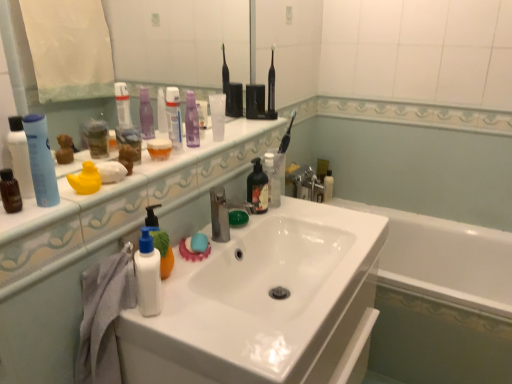
What is the approximate height of white glossy sink at center?

The height of white glossy sink at center is 5.77 inches.

What do you see at coordinates (218, 115) in the screenshot?
I see `transparent plastic mouthwash at center, the 3th mouthwash in the right-to-left sequence` at bounding box center [218, 115].

Measure the distance between transparent plastic mouthwash at center, the fourth mouthwash from the left, and camera.

The distance of transparent plastic mouthwash at center, the fourth mouthwash from the left, from camera is 1.34 meters.

The height and width of the screenshot is (384, 512). Describe the element at coordinates (159, 149) in the screenshot. I see `translucent plastic cup at center, arranged as the 5th mouthwash when viewed from the back` at that location.

At what (x,y) coordinates should I click in order to perform the action: click on translucent plastic bottle at center, the fifth toiletry when ordered from front to back. Please return your answer as a coordinate pair (x, y). This screenshot has height=384, width=512. Looking at the image, I should click on (273, 179).

What do you see at coordinates (273, 179) in the screenshot?
I see `translucent plastic bottle at center, which ranks as the fifth toiletry in left-to-right order` at bounding box center [273, 179].

Locate an element on the screen. white glossy sink at center is located at coordinates (265, 304).

Is blue matte shampoo bottle at left, which is counted as the 5th toiletry, starting from the back, positioned far away from white glossy sink at center?

No, there isn't a large distance between blue matte shampoo bottle at left, which is counted as the 5th toiletry, starting from the back, and white glossy sink at center.

Considering the positions of points (37, 144) and (258, 254), is point (37, 144) closer to camera compared to point (258, 254)?

Yes, it is in front of point (258, 254).

Is blue matte shampoo bottle at left, which is counted as the 5th toiletry, starting from the back, wider than white glossy sink at center?

In fact, blue matte shampoo bottle at left, which is counted as the 5th toiletry, starting from the back, might be narrower than white glossy sink at center.

Is blue matte shampoo bottle at left, arranged as the 1th toiletry when viewed from the front, inside or outside of white glossy sink at center?

blue matte shampoo bottle at left, arranged as the 1th toiletry when viewed from the front, cannot be found inside white glossy sink at center.

From the image's perspective, is translucent plastic bottle at center, arranged as the 1th toiletry when viewed from the right, located above brown matte bottle at left, the sixth mouthwash viewed from the right?

Indeed, from the image's perspective, translucent plastic bottle at center, arranged as the 1th toiletry when viewed from the right, is shown above brown matte bottle at left, the sixth mouthwash viewed from the right.

Which is correct: translucent plastic bottle at center, acting as the 1th toiletry starting from the back, is inside brown matte bottle at left, the first mouthwash viewed from the left, or outside of it?

translucent plastic bottle at center, acting as the 1th toiletry starting from the back, cannot be found inside brown matte bottle at left, the first mouthwash viewed from the left.

What's the angular difference between translucent plastic bottle at center, which ranks as the fifth toiletry in left-to-right order, and brown matte bottle at left, the sixth mouthwash viewed from the right,'s facing directions?

The facing directions of translucent plastic bottle at center, which ranks as the fifth toiletry in left-to-right order, and brown matte bottle at left, the sixth mouthwash viewed from the right, are 0.234 degrees apart.

From the image's perspective, is blue matte shampoo bottle at left, acting as the fifth toiletry starting from the right, located beneath translucent plastic bottle at center, which is the 5th mouthwash from left to right?

No, from the image's perspective, blue matte shampoo bottle at left, acting as the fifth toiletry starting from the right, is not below translucent plastic bottle at center, which is the 5th mouthwash from left to right.

Is translucent plastic bottle at center, arranged as the second mouthwash when viewed from the back, at the back of blue matte shampoo bottle at left, which is counted as the 5th toiletry, starting from the back?

No.

From the picture: How different are the orientations of blue matte shampoo bottle at left, arranged as the 1th toiletry when viewed from the front, and translucent plastic bottle at center, marked as the second mouthwash in a right-to-left arrangement, in degrees?

The angle between the facing direction of blue matte shampoo bottle at left, arranged as the 1th toiletry when viewed from the front, and the facing direction of translucent plastic bottle at center, marked as the second mouthwash in a right-to-left arrangement, is 0.234 degrees.

Based on their positions, is blue matte shampoo bottle at left, acting as the 1th toiletry starting from the left, located to the left or right of translucent plastic bottle at center, arranged as the second mouthwash when viewed from the back?

blue matte shampoo bottle at left, acting as the 1th toiletry starting from the left, is positioned on translucent plastic bottle at center, arranged as the second mouthwash when viewed from the back,'s left side.

Is translucent rubber soap at sink next to translucent plastic mouthwash at center, the fourth mouthwash from the right, and touching it?

No, translucent rubber soap at sink is not next to translucent plastic mouthwash at center, the fourth mouthwash from the right.

Does point (205, 244) lie in front of point (181, 150)?

Yes, point (205, 244) is in front of point (181, 150).

Considering the relative sizes of translucent rubber soap at sink and translucent plastic mouthwash at center, the fourth mouthwash from the right, in the image provided, is translucent rubber soap at sink smaller than translucent plastic mouthwash at center, the fourth mouthwash from the right,?

Indeed, translucent rubber soap at sink has a smaller size compared to translucent plastic mouthwash at center, the fourth mouthwash from the right.

Considering the relative positions of translucent rubber soap at sink and translucent plastic mouthwash at center, acting as the 4th mouthwash starting from the back, in the image provided, is translucent rubber soap at sink to the left or to the right of translucent plastic mouthwash at center, acting as the 4th mouthwash starting from the back,?

From the image, it's evident that translucent rubber soap at sink is to the right of translucent plastic mouthwash at center, acting as the 4th mouthwash starting from the back.

Is translucent plastic bottle at center, the fifth toiletry when ordered from front to back, looking in the opposite direction of white glossy counter top at upper center?

That's not correct — translucent plastic bottle at center, the fifth toiletry when ordered from front to back, is not looking away from white glossy counter top at upper center.

Does point (273, 176) lie behind point (245, 135)?

That is True.

Considering the sizes of objects translucent plastic bottle at center, arranged as the 1th toiletry when viewed from the right, and white glossy counter top at upper center in the image provided, who is bigger, translucent plastic bottle at center, arranged as the 1th toiletry when viewed from the right, or white glossy counter top at upper center?

With larger size is white glossy counter top at upper center.

Is translucent plastic bottle at center, arranged as the 1th toiletry when viewed from the right, situated inside white glossy counter top at upper center or outside?

translucent plastic bottle at center, arranged as the 1th toiletry when viewed from the right, is not inside white glossy counter top at upper center, it's outside.

Is rubber duck at left, placed as the 4th toiletry when sorted from right to left, beside brown matte bottle at left, the first mouthwash viewed from the left?

No, rubber duck at left, placed as the 4th toiletry when sorted from right to left, is not touching brown matte bottle at left, the first mouthwash viewed from the left.

From the image's perspective, does rubber duck at left, placed as the 3th toiletry when sorted from front to back, appear higher than brown matte bottle at left, marked as the 1th mouthwash in a front-to-back arrangement?

Yes, from the image's perspective, rubber duck at left, placed as the 3th toiletry when sorted from front to back, is over brown matte bottle at left, marked as the 1th mouthwash in a front-to-back arrangement.

Can you tell me how much rubber duck at left, placed as the 4th toiletry when sorted from right to left, and brown matte bottle at left, marked as the 1th mouthwash in a front-to-back arrangement, differ in facing direction?

The angular difference between rubber duck at left, placed as the 4th toiletry when sorted from right to left, and brown matte bottle at left, marked as the 1th mouthwash in a front-to-back arrangement, is 2.21 degrees.

Is rubber duck at left, which is counted as the 3th toiletry, starting from the back, surrounding brown matte bottle at left, the sixth mouthwash viewed from the right?

No.

From a real-world perspective, who is located lower, blue matte shampoo bottle at left, acting as the fifth toiletry starting from the right, or translucent rubber soap at sink?

translucent rubber soap at sink is physically lower.

Is blue matte shampoo bottle at left, arranged as the 1th toiletry when viewed from the front, inside the boundaries of translucent rubber soap at sink, or outside?

blue matte shampoo bottle at left, arranged as the 1th toiletry when viewed from the front, is located beyond the bounds of translucent rubber soap at sink.

Which of these two, blue matte shampoo bottle at left, acting as the 1th toiletry starting from the left, or translucent rubber soap at sink, stands taller?

With more height is blue matte shampoo bottle at left, acting as the 1th toiletry starting from the left.

Could you tell me if blue matte shampoo bottle at left, which is counted as the 5th toiletry, starting from the back, is facing translucent rubber soap at sink?

No.

Where is `the 4th toiletry counting from the left side of the white glossy sink at center`? the 4th toiletry counting from the left side of the white glossy sink at center is located at coordinates click(41, 160).

At what (x,y) coordinates should I click in order to perform the action: click on the 5th toiletry to the right of the brown matte bottle at left, the sixth mouthwash viewed from the right, starting your count from the anchor. Please return your answer as a coordinate pair (x, y). This screenshot has width=512, height=384. Looking at the image, I should click on (273, 179).

Estimate the real-world distances between objects in this image. Which object is further from brown matte bottle at left, the first mouthwash viewed from the left, translucent plastic bottle at center, the fifth toiletry when ordered from front to back, or purple matte lotion at center, marked as the 2th toiletry in a back-to-front arrangement?

translucent plastic bottle at center, the fifth toiletry when ordered from front to back, is positioned further to the anchor brown matte bottle at left, the first mouthwash viewed from the left.

Considering their positions, is brown matte bottle at left, the sixth mouthwash viewed from the right, positioned further to translucent plastic bottle at center, the fifth toiletry when ordered from front to back, than gray fabric towel at left?

brown matte bottle at left, the sixth mouthwash viewed from the right, is positioned further to the anchor translucent plastic bottle at center, the fifth toiletry when ordered from front to back.

Consider the image. From the image, which object appears to be farther from blue matte shampoo bottle at left, which is counted as the 5th toiletry, starting from the back, translucent plastic mouthwash at right, the first mouthwash from the right, or white glossy sink at center?

translucent plastic mouthwash at right, the first mouthwash from the right, is further to blue matte shampoo bottle at left, which is counted as the 5th toiletry, starting from the back.

Based on their spatial positions, is clear glass mirror at upper center or brown matte bottle at left, positioned as the 6th mouthwash in back-to-front order, closer to white glossy sink at center?

brown matte bottle at left, positioned as the 6th mouthwash in back-to-front order, is closer to white glossy sink at center.

Considering their positions, is translucent rubber soap at sink positioned closer to white glossy sink at center than translucent plastic bottle at center, acting as the 1th toiletry starting from the back?

translucent rubber soap at sink is closer to white glossy sink at center.

When comparing their distances from translucent plastic cup at center, arranged as the second mouthwash when viewed from the left, does white matte lotion at center, the third toiletry viewed from the left, or transparent plastic mouthwash at center, the 3th mouthwash in the right-to-left sequence, seem further?

white matte lotion at center, the third toiletry viewed from the left.

From the image, which object appears to be nearer to translucent plastic mouthwash at right, arranged as the sixth mouthwash when viewed from the left, translucent plastic mouthwash at center, acting as the 4th mouthwash starting from the back, or gray fabric towel at left?

translucent plastic mouthwash at center, acting as the 4th mouthwash starting from the back, is closer to translucent plastic mouthwash at right, arranged as the sixth mouthwash when viewed from the left.

Which object lies further to the anchor point purple matte lotion at center, the fourth toiletry in the left-to-right sequence, rubber duck at left, which is counted as the 3th toiletry, starting from the back, or gray fabric towel at left?

gray fabric towel at left is positioned further to the anchor purple matte lotion at center, the fourth toiletry in the left-to-right sequence.

Where is `soap between gray fabric towel at left and translucent plastic mouthwash at right, arranged as the sixth mouthwash when viewed from the left, along the z-axis`? This screenshot has height=384, width=512. soap between gray fabric towel at left and translucent plastic mouthwash at right, arranged as the sixth mouthwash when viewed from the left, along the z-axis is located at coordinates (199, 242).

This screenshot has height=384, width=512. I want to click on mirror between blue matte shampoo bottle at left, which is counted as the 5th toiletry, starting from the back, and translucent plastic bottle at center, which is the fifth mouthwash from front to back, in the front-back direction, so click(178, 42).

Where is `bath towel located between white glossy sink at center and translucent plastic mouthwash at right, the first mouthwash from the right, in the depth direction`? This screenshot has height=384, width=512. bath towel located between white glossy sink at center and translucent plastic mouthwash at right, the first mouthwash from the right, in the depth direction is located at coordinates (104, 316).

Where is `bath towel between brown matte bottle at left, marked as the 1th mouthwash in a front-to-back arrangement, and translucent plastic bottle at center, the fifth toiletry when ordered from front to back, along the z-axis`? The width and height of the screenshot is (512, 384). bath towel between brown matte bottle at left, marked as the 1th mouthwash in a front-to-back arrangement, and translucent plastic bottle at center, the fifth toiletry when ordered from front to back, along the z-axis is located at coordinates (104, 316).